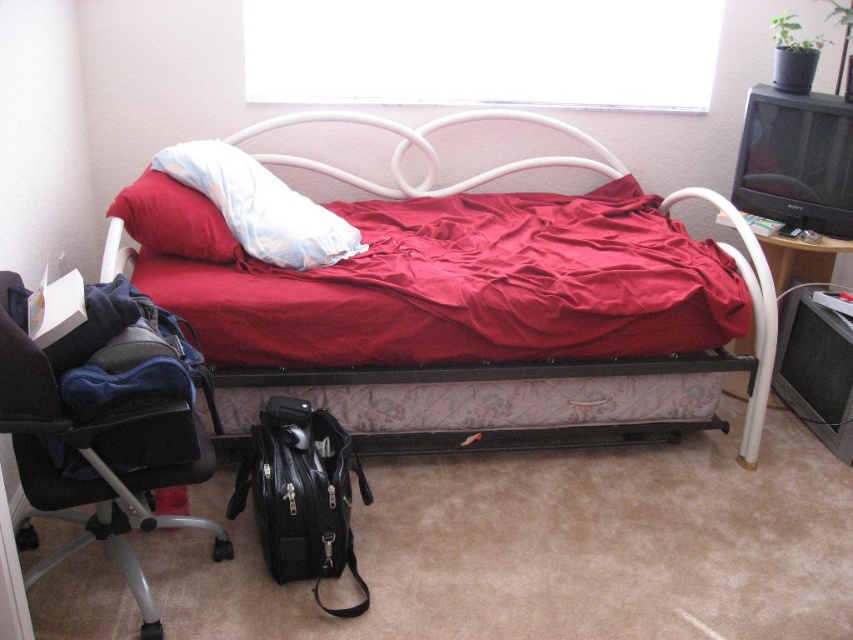
You are organizing the bedroom and need to move the black leather chair at lower left. Where is it currently located in relation to the white soft pillow at center?

The black leather chair at lower left is positioned under the white soft pillow at center.

You are moving into this bedroom and need to decide where to place a large wardrobe that requires 1.2 meters of space. Given the black leather chair at lower left and the red matte bed at center, which object might you need to move to accommodate the wardrobe?

The black leather chair at lower left is bigger than the red matte bed at center, so moving the black leather chair at lower left might be necessary to free up enough space for the wardrobe since it occupies more area.

You are trying to decide whether to place a new rectangular box between the black leather bag at lower center and the red matte bed at center. The box is 10 cm thick. Can you fit it there?

The black leather bag at lower center is thinner than the red matte bed at center. Since the box is 10 cm thick, and the black leather bag at lower center is thinner, there might be enough space if the available thickness between them accommodates the box. However, without knowing the exact dimensions of the space between them, it is uncertain. Please measure the space before placing the box.